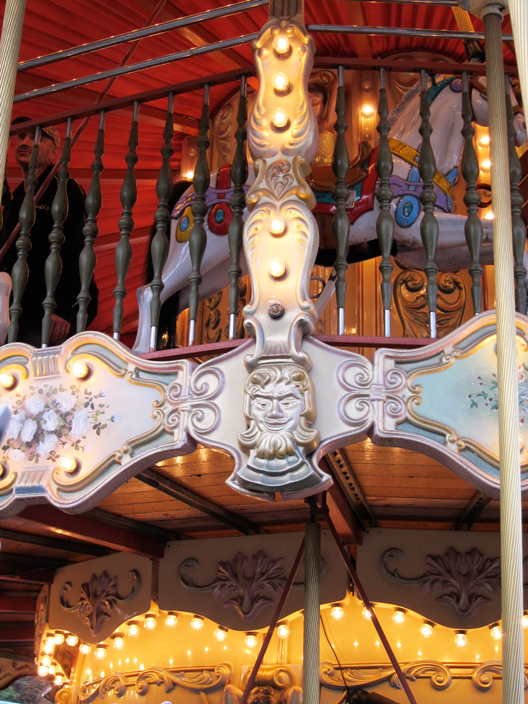
At what (x,y) coordinates should I click in order to perform the action: click on lighting top floor. Please return your answer as a coordinate pair (x, y). The image size is (528, 704). Looking at the image, I should click on point(367,110).